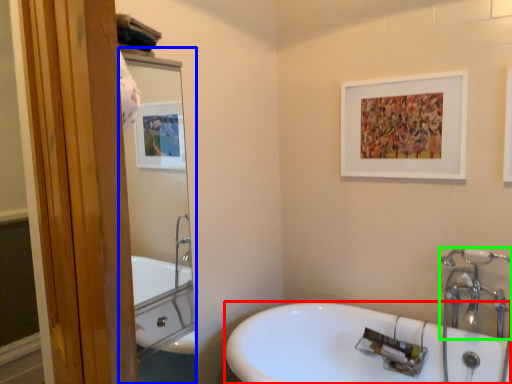
Question: Estimate the real-world distances between objects in this image. Which object is closer to sink (highlighted by a red box), mirror (highlighted by a blue box) or plumbing fixture (highlighted by a green box)?

Choices:
 (A) mirror
 (B) plumbing fixture

Answer: (B)